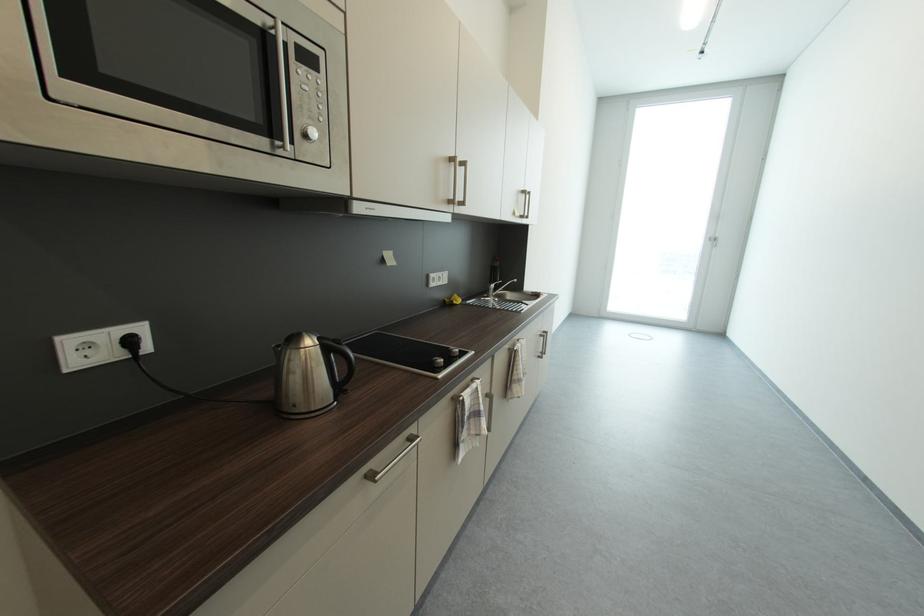
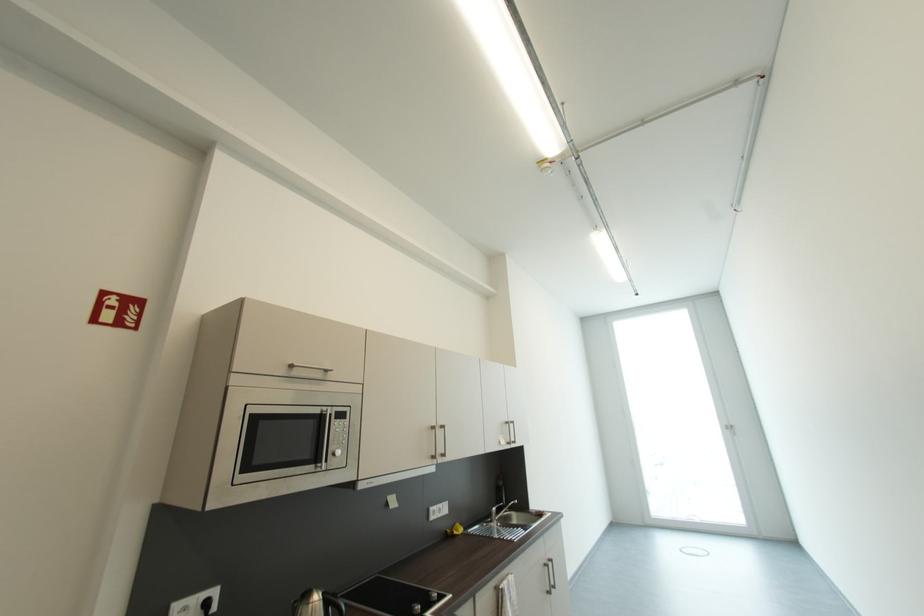
Where in the second image is the point corresponding to (302,46) from the first image?

(342, 413)